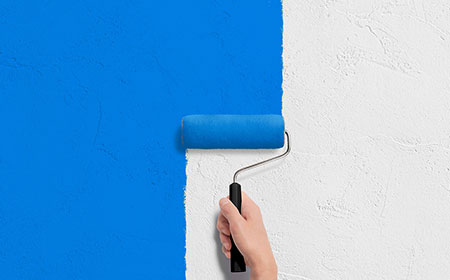
Where is `roller brush`? roller brush is located at coordinates (246, 125).